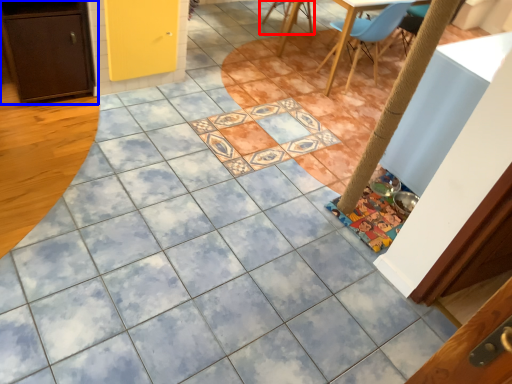
Question: Among these objects, which one is farthest to the camera, chair (highlighted by a red box) or cabinetry (highlighted by a blue box)?

Choices:
 (A) chair
 (B) cabinetry

Answer: (A)